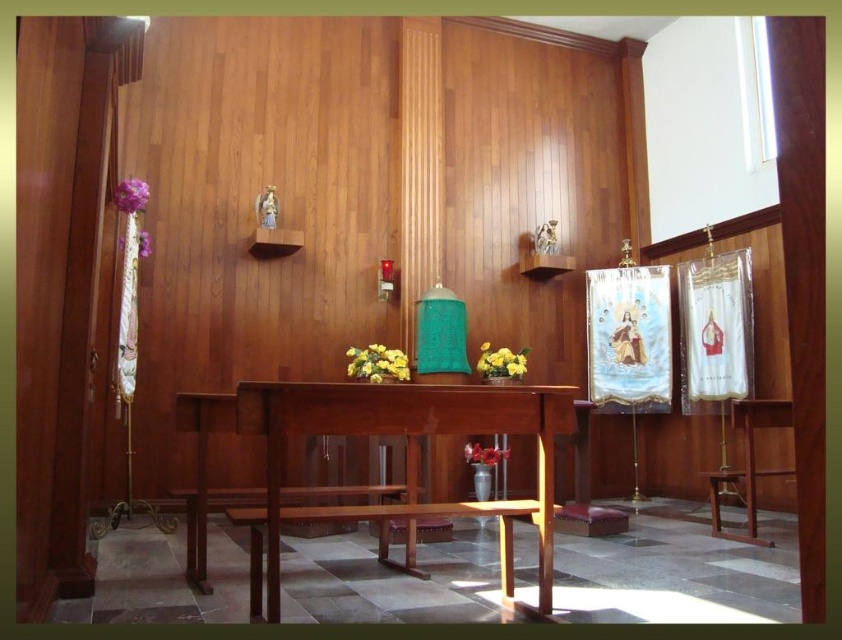
Question: Which object is the closest to the light brown wooden table at center?

Choices:
 (A) purple silk flower at upper left
 (B) matte glass vase at center
 (C) yellow matte flowers at center

Answer: (C)

Question: Estimate the real-world distances between objects in this image. Which object is closer to the yellow matte flower at center?

Choices:
 (A) purple fabric flower at upper left
 (B) yellow matte flowers at center
 (C) purple silk flower at upper left
 (D) matte glass vase at center

Answer: (D)

Question: In this image, where is yellow matte flowers at center located relative to yellow matte flower at center?

Choices:
 (A) above
 (B) below

Answer: (B)

Question: Does light brown wooden table at center appear on the left side of yellow matte flowers at center?

Choices:
 (A) yes
 (B) no

Answer: (B)

Question: Which of the following is the farthest from the observer?

Choices:
 (A) (515, 372)
 (B) (196, 429)
 (C) (126, 192)

Answer: (A)

Question: Can you confirm if yellow matte flower at center is smaller than purple fabric flower at upper left?

Choices:
 (A) no
 (B) yes

Answer: (A)